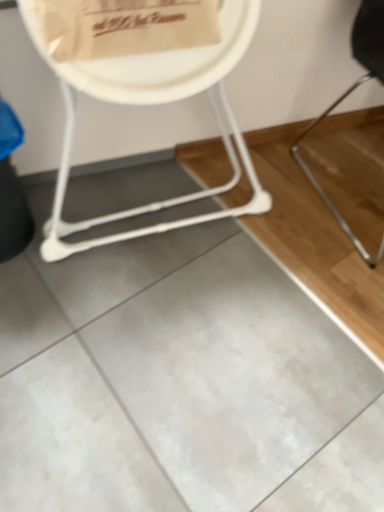
What is the approximate width of black metal chair at right, the 1th chair positioned from the right?

It is 23.37 inches.

Locate an element on the screen. black metal chair at right, the 1th chair positioned from the right is located at coordinates (352, 148).

Measure the distance between white paper plate at upper center and camera.

white paper plate at upper center and camera are 80.40 centimeters apart from each other.

Where is `black metal chair at right, the 1th chair positioned from the right`? black metal chair at right, the 1th chair positioned from the right is located at coordinates (352, 148).

Visually, is white paper plate at upper center positioned to the left or to the right of black metal chair at right, the 2th chair positioned from the left?

In the image, white paper plate at upper center appears on the left side of black metal chair at right, the 2th chair positioned from the left.

Which of these two, white paper plate at upper center or black metal chair at right, the 2th chair positioned from the left, stands shorter?

white paper plate at upper center is shorter.

Is white paper plate at upper center facing towards black metal chair at right, the 1th chair positioned from the right?

No, white paper plate at upper center is not oriented towards black metal chair at right, the 1th chair positioned from the right.

Is point (351, 196) less distant than point (80, 76)?

No.

Does black metal chair at right, the 2th chair positioned from the left, turn towards white plastic chair at upper left, which is counted as the 1th chair, starting from the left?

No.

From a real-world perspective, is black metal chair at right, the 2th chair positioned from the left, located higher than white plastic chair at upper left, which is counted as the 1th chair, starting from the left?

Incorrect, from a real-world perspective, black metal chair at right, the 2th chair positioned from the left, is lower than white plastic chair at upper left, which is counted as the 1th chair, starting from the left.

From the image's perspective, who appears lower, black metal chair at right, the 2th chair positioned from the left, or white plastic chair at upper left, the 2th chair in the right-to-left sequence?

white plastic chair at upper left, the 2th chair in the right-to-left sequence.

Can you tell me how much black metal chair at right, the 1th chair positioned from the right, and white paper plate at upper center differ in facing direction?

black metal chair at right, the 1th chair positioned from the right, and white paper plate at upper center are facing 9.04e-06 degrees away from each other.

Measure the distance between black metal chair at right, the 2th chair positioned from the left, and white paper plate at upper center.

black metal chair at right, the 2th chair positioned from the left, is 30.33 inches away from white paper plate at upper center.

Is black metal chair at right, the 2th chair positioned from the left, taller than white paper plate at upper center?

Correct, black metal chair at right, the 2th chair positioned from the left, is much taller as white paper plate at upper center.

From the image's perspective, does black metal chair at right, the 2th chair positioned from the left, appear higher than white paper plate at upper center?

Incorrect, from the image's perspective, black metal chair at right, the 2th chair positioned from the left, is lower than white paper plate at upper center.

Considering the relative sizes of white plastic chair at upper left, the 2th chair in the right-to-left sequence, and white paper plate at upper center in the image provided, is white plastic chair at upper left, the 2th chair in the right-to-left sequence, bigger than white paper plate at upper center?

Correct, white plastic chair at upper left, the 2th chair in the right-to-left sequence, is larger in size than white paper plate at upper center.

From a real-world perspective, who is located lower, white plastic chair at upper left, the 2th chair in the right-to-left sequence, or white paper plate at upper center?

white plastic chair at upper left, the 2th chair in the right-to-left sequence.

The height and width of the screenshot is (512, 384). I want to click on paper plate above the white plastic chair at upper left, the 2th chair in the right-to-left sequence (from a real-world perspective), so click(x=173, y=64).

Is point (227, 60) positioned after point (232, 7)?

Yes, it is.

This screenshot has height=512, width=384. In order to click on chair above the black metal chair at right, the 1th chair positioned from the right (from a real-world perspective) in this screenshot , I will do `click(153, 103)`.

Considering the relative positions of white plastic chair at upper left, the 2th chair in the right-to-left sequence, and black metal chair at right, the 2th chair positioned from the left, in the image provided, is white plastic chair at upper left, the 2th chair in the right-to-left sequence, to the left or to the right of black metal chair at right, the 2th chair positioned from the left,?

white plastic chair at upper left, the 2th chair in the right-to-left sequence, is to the left of black metal chair at right, the 2th chair positioned from the left.

Consider the image. Who is shorter, white plastic chair at upper left, which is counted as the 1th chair, starting from the left, or black metal chair at right, the 2th chair positioned from the left?

With less height is black metal chair at right, the 2th chair positioned from the left.

Looking at this image, which is farther, (191,195) or (370,188)?

Positioned behind is point (370,188).

From a real-world perspective, which is physically above, white paper plate at upper center or white plastic chair at upper left, the 2th chair in the right-to-left sequence?

white paper plate at upper center.

From their relative heights in the image, would you say white paper plate at upper center is taller or shorter than white plastic chair at upper left, which is counted as the 1th chair, starting from the left?

white paper plate at upper center is shorter than white plastic chair at upper left, which is counted as the 1th chair, starting from the left.

In the image, is white paper plate at upper center positioned in front of or behind white plastic chair at upper left, the 2th chair in the right-to-left sequence?

Clearly, white paper plate at upper center is behind white plastic chair at upper left, the 2th chair in the right-to-left sequence.

Considering the relative positions of white paper plate at upper center and white plastic chair at upper left, the 2th chair in the right-to-left sequence, in the image provided, is white paper plate at upper center to the right of white plastic chair at upper left, the 2th chair in the right-to-left sequence, from the viewer's perspective?

Yes.

From a real-world perspective, which chair is the 2nd one underneath the white paper plate at upper center? Please provide its 2D coordinates.

[(352, 148)]

Find the location of a particular element. The image size is (384, 512). chair above the white plastic chair at upper left, which is counted as the 1th chair, starting from the left (from the image's perspective) is located at coordinates (352, 148).

Which object lies nearer to the anchor point white paper plate at upper center, black metal chair at right, the 1th chair positioned from the right, or white plastic chair at upper left, the 2th chair in the right-to-left sequence?

white plastic chair at upper left, the 2th chair in the right-to-left sequence, is closer to white paper plate at upper center.

When comparing their distances from white plastic chair at upper left, the 2th chair in the right-to-left sequence, does white paper plate at upper center or black metal chair at right, the 2th chair positioned from the left, seem closer?

white paper plate at upper center is positioned closer to the anchor white plastic chair at upper left, the 2th chair in the right-to-left sequence.

Consider the image. Based on their spatial positions, is black metal chair at right, the 2th chair positioned from the left, or white paper plate at upper center closer to white plastic chair at upper left, which is counted as the 1th chair, starting from the left?

Among the two, white paper plate at upper center is located nearer to white plastic chair at upper left, which is counted as the 1th chair, starting from the left.

Which object lies further to the anchor point white paper plate at upper center, white plastic chair at upper left, the 2th chair in the right-to-left sequence, or black metal chair at right, the 2th chair positioned from the left?

The object further to white paper plate at upper center is black metal chair at right, the 2th chair positioned from the left.

Estimate the real-world distances between objects in this image. Which object is closer to black metal chair at right, the 1th chair positioned from the right, white paper plate at upper center or white plastic chair at upper left, the 2th chair in the right-to-left sequence?

white plastic chair at upper left, the 2th chair in the right-to-left sequence.

Estimate the real-world distances between objects in this image. Which object is closer to black metal chair at right, the 2th chair positioned from the left, white plastic chair at upper left, the 2th chair in the right-to-left sequence, or white paper plate at upper center?

white plastic chair at upper left, the 2th chair in the right-to-left sequence.

Where is `paper plate situated between white plastic chair at upper left, the 2th chair in the right-to-left sequence, and black metal chair at right, the 2th chair positioned from the left, from left to right`? The image size is (384, 512). paper plate situated between white plastic chair at upper left, the 2th chair in the right-to-left sequence, and black metal chair at right, the 2th chair positioned from the left, from left to right is located at coordinates (173, 64).